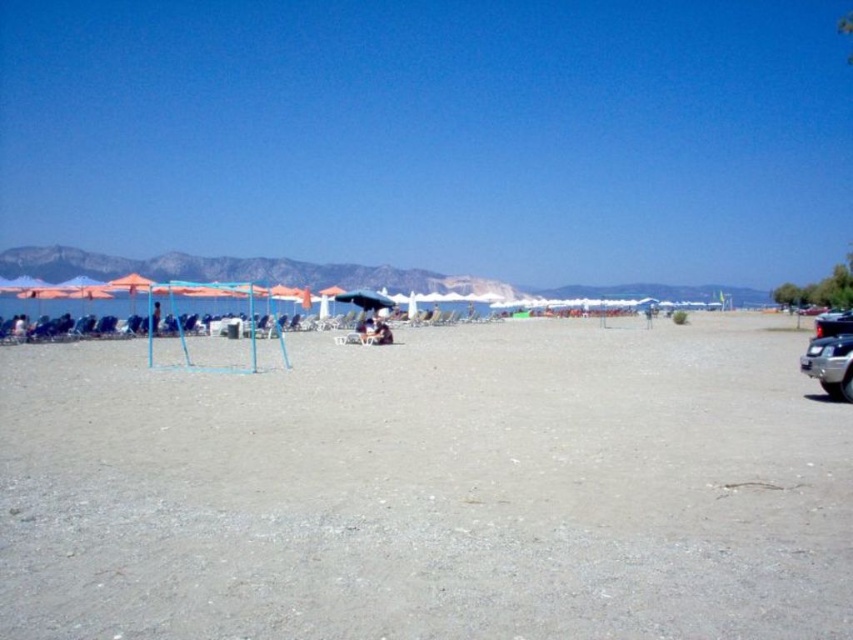
Question: Which point is closer to the camera?

Choices:
 (A) metallic silver car at right
 (B) gray sand at center

Answer: (B)

Question: Can you confirm if gray sand at center is positioned below blue denim shorts at center?

Choices:
 (A) yes
 (B) no

Answer: (A)

Question: Observing the image, what is the correct spatial positioning of gray sand at center in reference to shiny black car at right?

Choices:
 (A) left
 (B) right

Answer: (A)

Question: Is shiny black car at right bigger than blue denim shorts at center?

Choices:
 (A) no
 (B) yes

Answer: (B)

Question: Which object is the farthest from the metallic silver car at right?

Choices:
 (A) blue denim shorts at center
 (B) light blue fabric umbrella at center

Answer: (B)

Question: Which is nearer to the metallic silver car at right?

Choices:
 (A) gray sand at center
 (B) light blue fabric umbrella at center
 (C) shiny black car at right
 (D) matte black umbrella at center

Answer: (A)